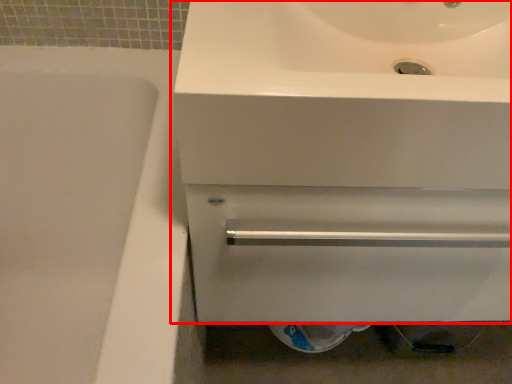
Question: From the image's perspective, where is sink (annotated by the red box) located in relation to bath in the image?

Choices:
 (A) above
 (B) below

Answer: (A)